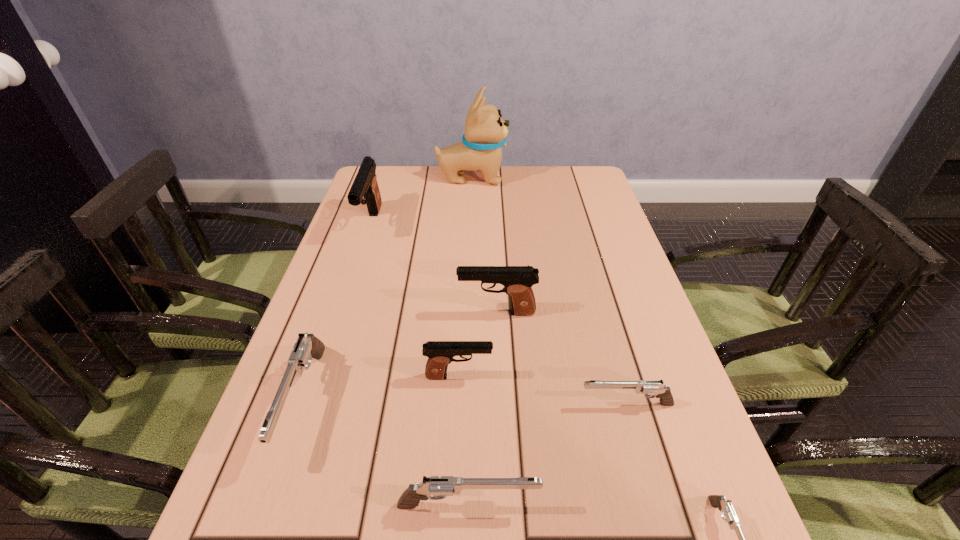
Where is `the second smallest silver pistol`? This screenshot has height=540, width=960. the second smallest silver pistol is located at coordinates (656, 387).

This screenshot has width=960, height=540. Identify the location of the second shortest pistol. (656, 387).

Identify the location of free location located on the face of the tallest object. The image size is (960, 540). (597, 178).

Find the location of a particular element. free location located at the barrel of the farthest black pistol is located at coordinates (348, 291).

Identify the location of blank space located 0.340m at the barrel of the third farthest object. (313, 313).

You are a GUI agent. You are given a task and a screenshot of the screen. Output one action in this format:
    pyautogui.click(x=<x>, y=<y>)
    Task: Click on the vacant space located at the barrel of the third farthest object
    This screenshot has width=960, height=540.
    Given the screenshot: What is the action you would take?
    pyautogui.click(x=338, y=313)

I want to click on blank space located at the barrel of the third farthest object, so click(433, 313).

Locate an element on the screen. This screenshot has width=960, height=540. vacant space located on the front-facing side of the biggest silver pistol is located at coordinates (267, 507).

Locate an element on the screen. The width and height of the screenshot is (960, 540). vacant space situated 0.060m at the barrel of the nearest black pistol is located at coordinates (521, 376).

Where is `vacant space located 0.100m on the front-facing side of the third shortest pistol`? This screenshot has height=540, width=960. vacant space located 0.100m on the front-facing side of the third shortest pistol is located at coordinates (601, 505).